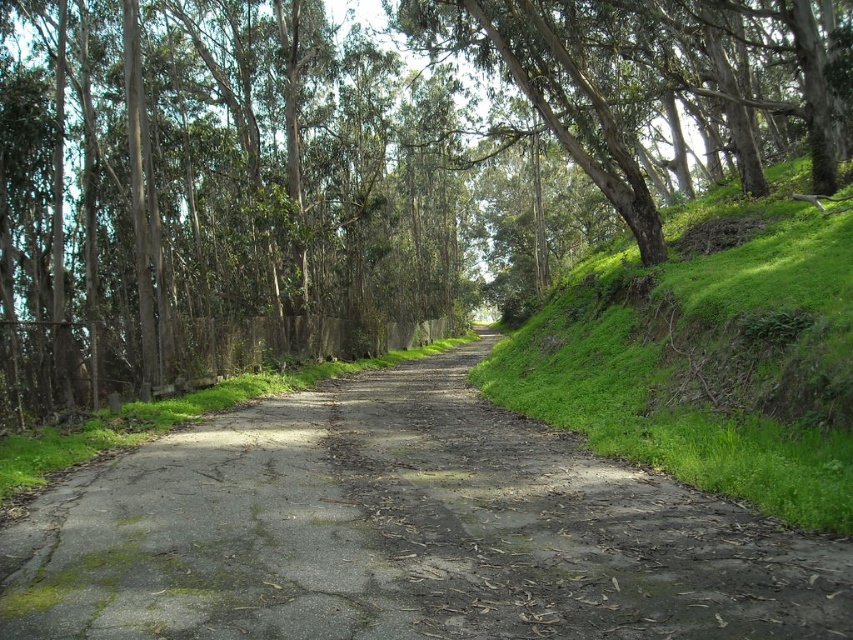
Which of these two, green leafy tree at center or green grassy hillside at right, stands taller?

With more height is green leafy tree at center.

Is green leafy tree at center closer to camera compared to green grassy hillside at right?

No, it is not.

Image resolution: width=853 pixels, height=640 pixels. I want to click on green leafy tree at center, so click(358, 166).

Is point (466, 602) farther from viewer compared to point (599, 385)?

No.

Is dull gray asphalt at center smaller than green grassy hillside at right?

Yes.

This screenshot has height=640, width=853. Describe the element at coordinates (403, 532) in the screenshot. I see `dull gray asphalt at center` at that location.

Where is `dull gray asphalt at center`? The width and height of the screenshot is (853, 640). dull gray asphalt at center is located at coordinates (403, 532).

Between green leafy tree at center and dull gray asphalt at center, which one appears on the left side from the viewer's perspective?

dull gray asphalt at center

Where is `green leafy tree at center`? This screenshot has height=640, width=853. green leafy tree at center is located at coordinates (358, 166).

The height and width of the screenshot is (640, 853). I want to click on green leafy tree at center, so point(358,166).